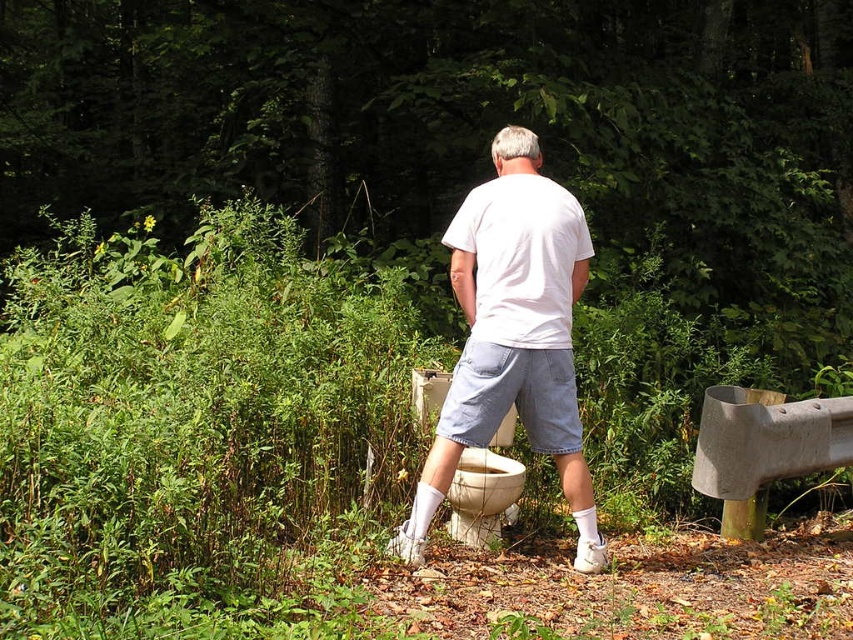
Who is shorter, concrete at right or white glossy toilet bowl at lower center?

With less height is white glossy toilet bowl at lower center.

Is concrete at right taller than white glossy toilet bowl at lower center?

Correct, concrete at right is much taller as white glossy toilet bowl at lower center.

What do you see at coordinates (763, 449) in the screenshot?
I see `concrete at right` at bounding box center [763, 449].

Where is `concrete at right`? The height and width of the screenshot is (640, 853). concrete at right is located at coordinates (763, 449).

Is white cotton shirt at center smaller than white glossy toilet bowl at lower center?

No, white cotton shirt at center is not smaller than white glossy toilet bowl at lower center.

Is white cotton shirt at center shorter than white glossy toilet bowl at lower center?

In fact, white cotton shirt at center may be taller than white glossy toilet bowl at lower center.

Who is more forward, (479,323) or (476,528)?

Positioned in front is point (479,323).

Where is `white cotton shirt at center`? Image resolution: width=853 pixels, height=640 pixels. white cotton shirt at center is located at coordinates tap(514, 336).

Is point (561, 189) closer to viewer compared to point (804, 420)?

That is True.

Does white cotton shirt at center come in front of concrete at right?

Yes.

Is point (465, 248) positioned in front of point (722, 488)?

Yes.

The height and width of the screenshot is (640, 853). Find the location of `white cotton shirt at center`. white cotton shirt at center is located at coordinates (514, 336).